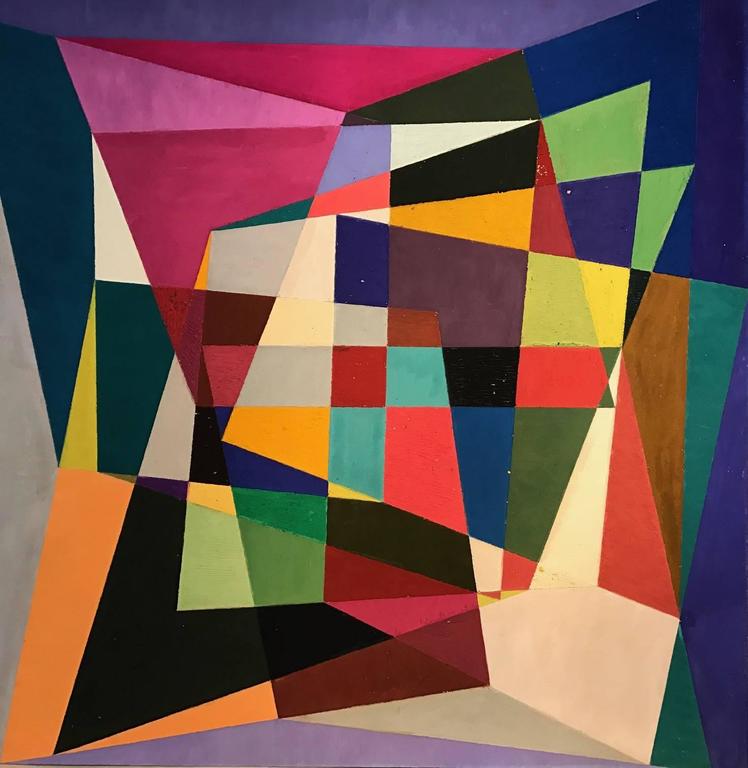
Find the location of `red center of painting`. red center of painting is located at coordinates (361, 386).